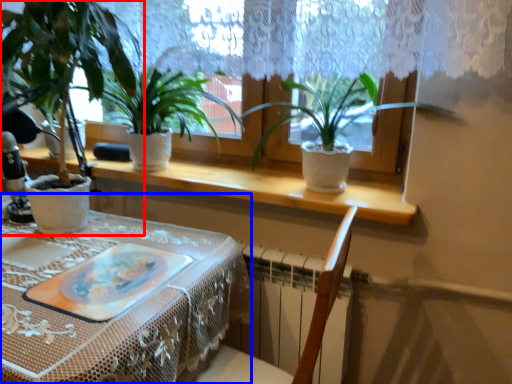
Question: Which point is further to the camera, houseplant (highlighted by a red box) or table (highlighted by a blue box)?

Choices:
 (A) houseplant
 (B) table

Answer: (A)